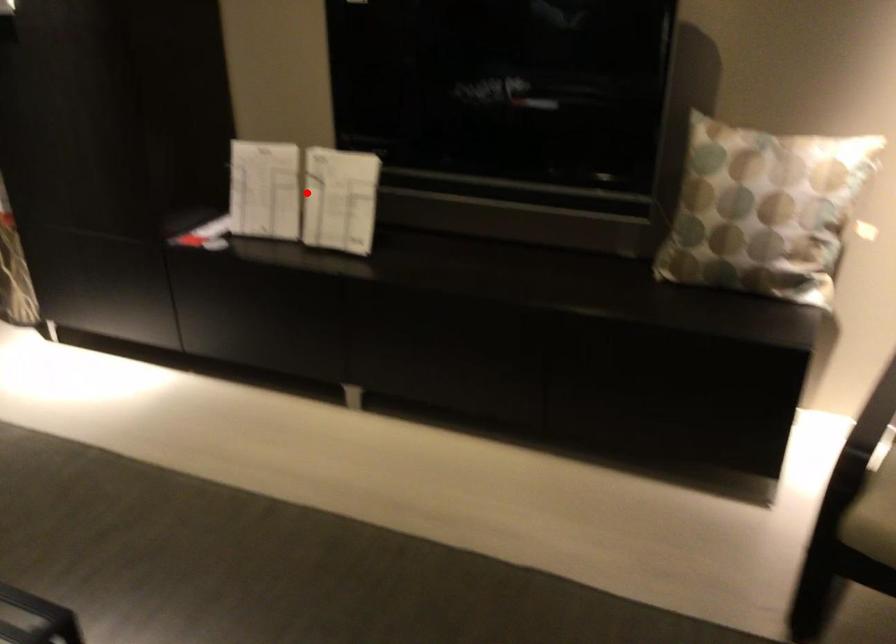
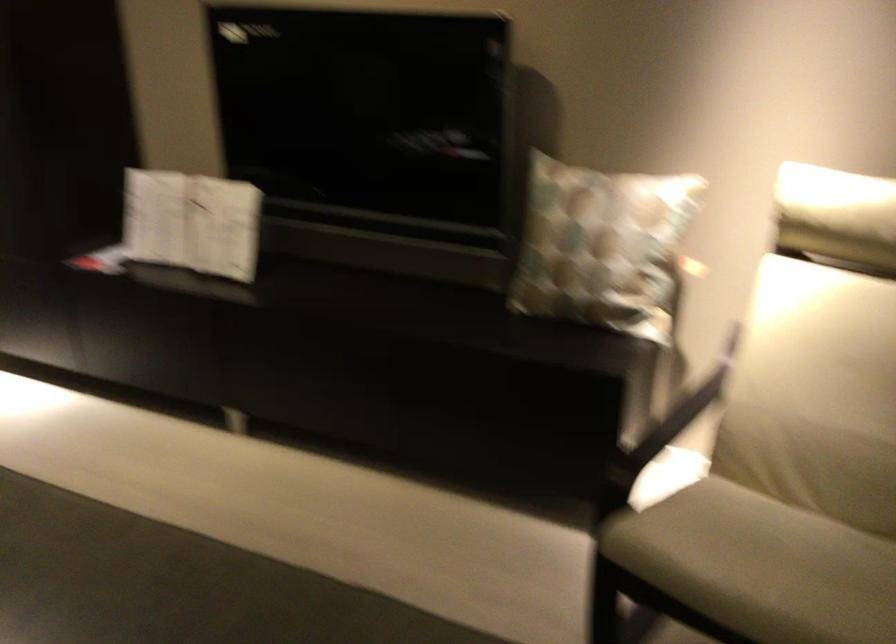
Locate, in the second image, the point that corresponds to the highlighted location in the first image.

(192, 222)